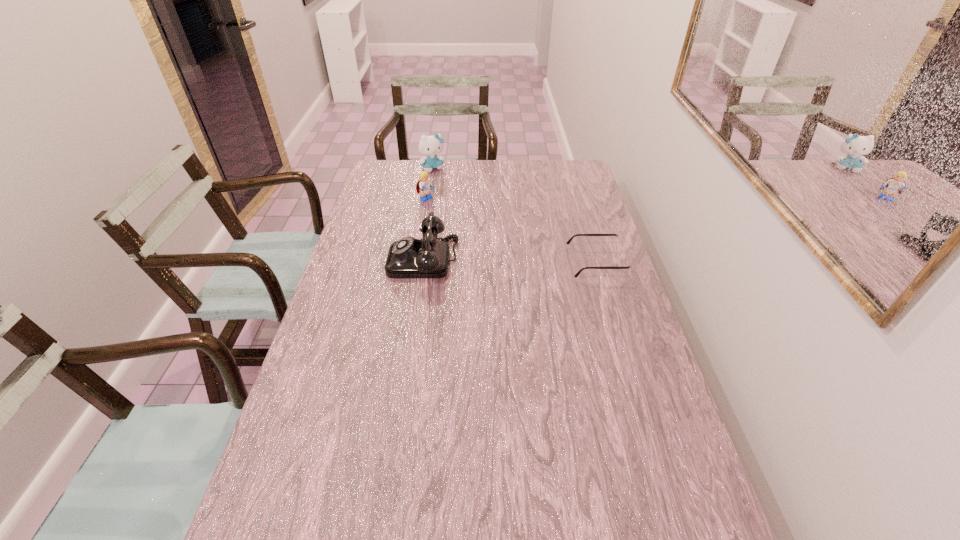
Locate which object ranks in proximity to the farthest object. Please provide its 2D coordinates. Your answer should be formatted as a tuple, i.e. [(x, y)], where the tuple contains the x and y coordinates of a point satisfying the conditions above.

[(424, 186)]

Identify which object is the second closest to the Lego. Please provide its 2D coordinates. Your answer should be formatted as a tuple, i.e. [(x, y)], where the tuple contains the x and y coordinates of a point satisfying the conditions above.

[(409, 257)]

I want to click on vacant point that satisfies the following two spatial constraints: 1. on the front side of the kitten; 2. at the hinge ends of the shortest object, so click(418, 262).